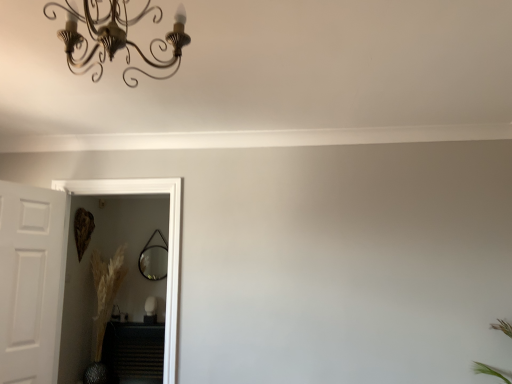
Where is `silvery metallic vase at lower left`? silvery metallic vase at lower left is located at coordinates (104, 307).

What do you see at coordinates (154, 259) in the screenshot? I see `matte black mirror at center` at bounding box center [154, 259].

Describe the element at coordinates (168, 242) in the screenshot. The height and width of the screenshot is (384, 512). I see `clear glass door at left` at that location.

Locate an element on the screen. black matte radiator at lower left is located at coordinates (134, 352).

What is the approximate height of white matte door at left?

white matte door at left is 1.30 meters in height.

Find the location of `white matte door at left`. white matte door at left is located at coordinates (30, 281).

The height and width of the screenshot is (384, 512). What are the coordinates of `silvery metallic vase at lower left` in the screenshot? It's located at (104, 307).

Considering the positions of points (109, 271) and (41, 369), is point (109, 271) closer to camera compared to point (41, 369)?

No, (109, 271) is behind (41, 369).

Is white matte door at left surrounded by silvery metallic vase at lower left?

No, white matte door at left is not inside silvery metallic vase at lower left.

Based on the photo, from the image's perspective, between silvery metallic vase at lower left and white matte door at left, which one is located above?

white matte door at left.

Which object is positioned more to the right, silvery metallic vase at lower left or white matte door at left?

white matte door at left.

From the image's perspective, is silvery metallic vase at lower left on metallic chandelier at upper left?

No, from the image's perspective, silvery metallic vase at lower left is not above metallic chandelier at upper left.

Does point (109, 282) come farther from viewer compared to point (92, 56)?

That is True.

Can you confirm if silvery metallic vase at lower left is bigger than metallic chandelier at upper left?

Correct, silvery metallic vase at lower left is larger in size than metallic chandelier at upper left.

Which object is further away from the camera, silvery metallic vase at lower left or metallic chandelier at upper left?

silvery metallic vase at lower left is behind.

How different are the orientations of silvery metallic vase at lower left and clear glass door at left in degrees?

0.44 degrees.

In the scene shown: Is silvery metallic vase at lower left oriented towards clear glass door at left?

No, silvery metallic vase at lower left is not aimed at clear glass door at left.

Can you confirm if silvery metallic vase at lower left is taller than clear glass door at left?

Correct, silvery metallic vase at lower left is much taller as clear glass door at left.

From the picture: Is silvery metallic vase at lower left in front of or behind clear glass door at left in the image?

silvery metallic vase at lower left is behind clear glass door at left.

Looking at their sizes, would you say matte black mirror at center is wider or thinner than white matte door at left?

In the image, matte black mirror at center appears to be more narrow than white matte door at left.

From the image's perspective, which one is positioned higher, matte black mirror at center or white matte door at left?

white matte door at left appears higher in the image.

Is point (152, 248) closer to camera compared to point (49, 367)?

No, it is not.

Can you confirm if matte black mirror at center is taller than white matte door at left?

In fact, matte black mirror at center may be shorter than white matte door at left.

Is black matte radiator at lower left facing towards metallic chandelier at upper left?

Yes, black matte radiator at lower left is turned towards metallic chandelier at upper left.

The width and height of the screenshot is (512, 384). Find the location of `light fixture that is above the black matte radiator at lower left (from a real-world perspective)`. light fixture that is above the black matte radiator at lower left (from a real-world perspective) is located at coordinates (117, 37).

Considering the relative positions of black matte radiator at lower left and metallic chandelier at upper left in the image provided, is black matte radiator at lower left behind metallic chandelier at upper left?

Yes.

Is the position of silvery metallic vase at lower left more distant than that of matte black mirror at center?

No.

Considering the positions of point (108, 264) and point (165, 261), is point (108, 264) closer or farther from the camera than point (165, 261)?

Point (108, 264) appears to be farther away from the viewer than point (165, 261).

From their relative heights in the image, would you say silvery metallic vase at lower left is taller or shorter than matte black mirror at center?

silvery metallic vase at lower left is taller than matte black mirror at center.

Which object is positioned more to the left, silvery metallic vase at lower left or matte black mirror at center?

silvery metallic vase at lower left.

Is matte black mirror at center far from black matte radiator at lower left?

Indeed, matte black mirror at center is not near black matte radiator at lower left.

Which is less distant, [164,271] or [106,330]?

Point [106,330]

In the image, is matte black mirror at center positioned in front of or behind black matte radiator at lower left?

matte black mirror at center is behind black matte radiator at lower left.

Is matte black mirror at center bigger than black matte radiator at lower left?

No.

Identify the location of door positioned vertically above the silvery metallic vase at lower left (from a real-world perspective). (30, 281).

Find the location of a particular element. plant that appears below the metallic chandelier at upper left (from the image's perspective) is located at coordinates (104, 307).

Considering their positions, is black matte radiator at lower left positioned closer to matte black mirror at center than metallic chandelier at upper left?

black matte radiator at lower left is closer to matte black mirror at center.

Estimate the real-world distances between objects in this image. Which object is closer to metallic chandelier at upper left, matte black mirror at center or silvery metallic vase at lower left?

Based on the image, silvery metallic vase at lower left appears to be nearer to metallic chandelier at upper left.

Considering their positions, is matte black mirror at center positioned further to silvery metallic vase at lower left than metallic chandelier at upper left?

metallic chandelier at upper left is positioned further to the anchor silvery metallic vase at lower left.

From the image, which object appears to be nearer to white matte door at left, silvery metallic vase at lower left or metallic chandelier at upper left?

The object closer to white matte door at left is metallic chandelier at upper left.

When comparing their distances from silvery metallic vase at lower left, does clear glass door at left or white matte door at left seem further?

clear glass door at left lies further to silvery metallic vase at lower left than the other object.

Considering their positions, is black matte radiator at lower left positioned closer to silvery metallic vase at lower left than metallic chandelier at upper left?

black matte radiator at lower left is closer to silvery metallic vase at lower left.

When comparing their distances from metallic chandelier at upper left, does black matte radiator at lower left or white matte door at left seem closer?

white matte door at left.

Based on their spatial positions, is matte black mirror at center or white matte door at left closer to metallic chandelier at upper left?

Based on the image, white matte door at left appears to be nearer to metallic chandelier at upper left.

You are a GUI agent. You are given a task and a screenshot of the screen. Output one action in this format:
    pyautogui.click(x=<x>, y=<y>)
    Task: Click on the glass door located between white matte door at left and silvery metallic vase at lower left in the depth direction
    The width and height of the screenshot is (512, 384).
    Given the screenshot: What is the action you would take?
    pyautogui.click(x=168, y=242)

Locate an element on the screen. furniture between metallic chandelier at upper left and matte black mirror at center from front to back is located at coordinates (134, 352).

Where is `furniture between clear glass door at left and matte black mirror at center along the z-axis`? furniture between clear glass door at left and matte black mirror at center along the z-axis is located at coordinates (134, 352).

This screenshot has height=384, width=512. Find the location of `plant between metallic chandelier at upper left and matte black mirror at center along the z-axis`. plant between metallic chandelier at upper left and matte black mirror at center along the z-axis is located at coordinates (104, 307).